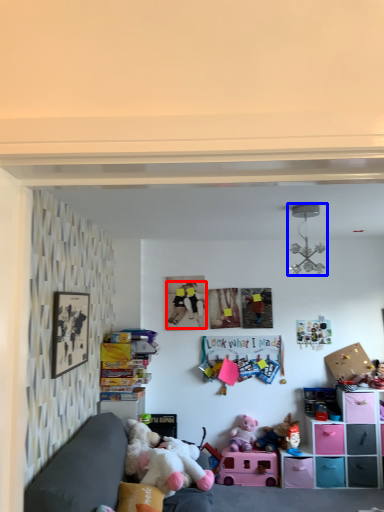
Question: Which object is closer to the camera taking this photo, person (highlighted by a red box) or toy (highlighted by a blue box)?

Choices:
 (A) person
 (B) toy

Answer: (B)